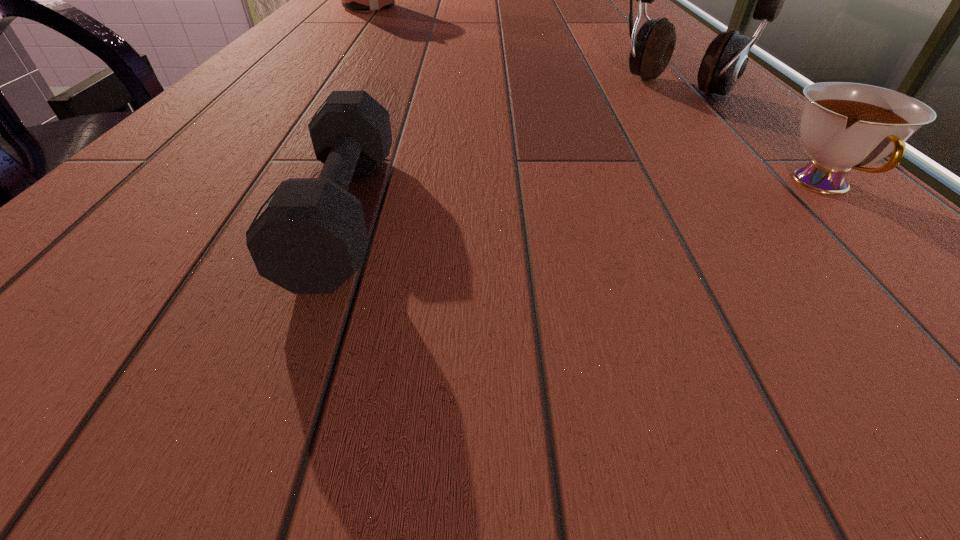
Find the location of `dumbbell`. dumbbell is located at coordinates (309, 237).

Where is `teacup`? The image size is (960, 540). teacup is located at coordinates (844, 125).

In order to click on the third shortest object in this screenshot , I will do `click(363, 0)`.

The width and height of the screenshot is (960, 540). Find the location of `the leftmost object`. the leftmost object is located at coordinates (363, 0).

At what (x,y) coordinates should I click in order to perform the action: click on the second farthest object. Please return your answer as a coordinate pair (x, y). The width and height of the screenshot is (960, 540). Looking at the image, I should click on (725, 60).

Where is `the tallest object`? The width and height of the screenshot is (960, 540). the tallest object is located at coordinates (725, 60).

I want to click on vacant point located 0.390m on the back of the dumbbell, so click(402, 62).

The height and width of the screenshot is (540, 960). What are the coordinates of `vacant space located 0.050m on the side of the teacup with the handle` in the screenshot? It's located at coord(888,246).

Locate an element on the screen. The image size is (960, 540). free space located 0.400m on the side with the handle of the leftmost object is located at coordinates (426, 62).

Identify the location of free space located on the side with the handle of the leftmost object. The width and height of the screenshot is (960, 540). (397, 38).